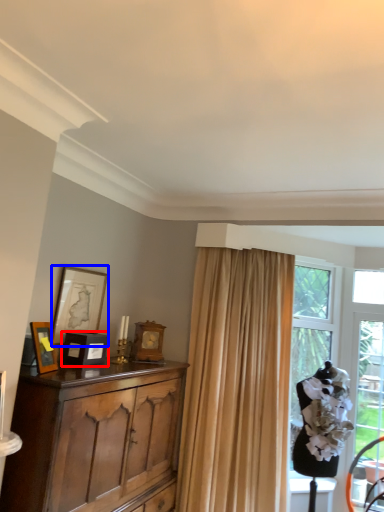
Question: Which of the following is the closest to the observer, picture frame (highlighted by a red box) or picture frame (highlighted by a blue box)?

Choices:
 (A) picture frame
 (B) picture frame

Answer: (A)